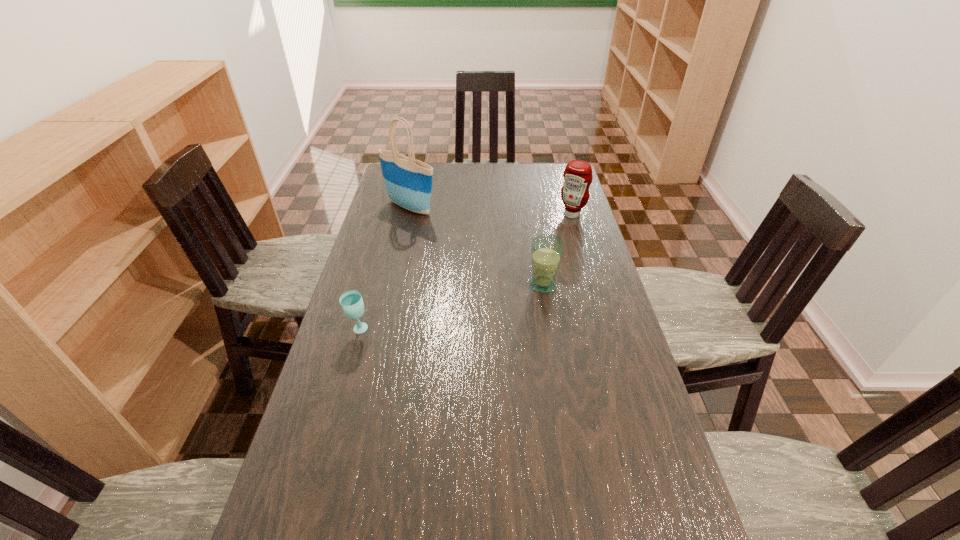
In order to click on vacant region located 0.250m on the front of the left glass in this screenshot , I will do `click(334, 417)`.

The image size is (960, 540). In order to click on tote bag at the left edge in this screenshot , I will do `click(408, 182)`.

I want to click on glass located in the left edge section of the desktop, so click(351, 301).

In order to click on object that is at the right edge in this screenshot , I will do `click(577, 175)`.

I want to click on vacant space at the far edge, so (x=488, y=165).

In the image, there is a desktop. Where is `vacant space at the left edge`? vacant space at the left edge is located at coordinates (354, 288).

Image resolution: width=960 pixels, height=540 pixels. Identify the location of blank area at the right edge. (560, 219).

This screenshot has height=540, width=960. I want to click on free spot between the nearest object and the tote bag, so click(385, 269).

Locate an element on the screen. empty location between the second object from right to left and the shorter glass is located at coordinates (450, 307).

You are a GUI agent. You are given a task and a screenshot of the screen. Output one action in this format:
    pyautogui.click(x=<x>, y=<y>)
    Task: Click on the free space between the rightmost object and the tote bag
    The width and height of the screenshot is (960, 540).
    Given the screenshot: What is the action you would take?
    pyautogui.click(x=492, y=211)